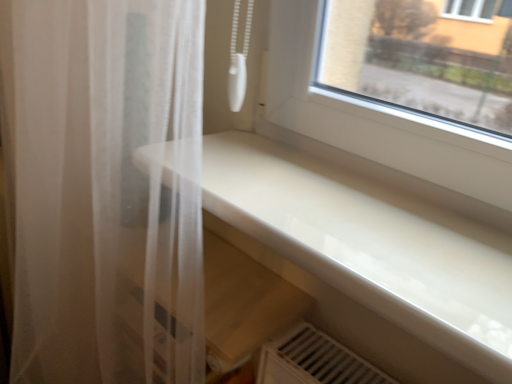
Question: Does point (422, 294) appear closer or farther from the camera than point (146, 288)?

Choices:
 (A) farther
 (B) closer

Answer: (B)

Question: Is white glossy counter top at center inside the boundaries of translucent white curtain at left, or outside?

Choices:
 (A) outside
 (B) inside

Answer: (A)

Question: Looking at their shapes, would you say white glossy counter top at center is wider or thinner than translucent white curtain at left?

Choices:
 (A) wide
 (B) thin

Answer: (A)

Question: From a real-world perspective, relative to white glossy counter top at center, is translucent white curtain at left vertically above or below?

Choices:
 (A) above
 (B) below

Answer: (B)

Question: Considering the positions of translucent white curtain at left and white glossy counter top at center in the image, is translucent white curtain at left wider or thinner than white glossy counter top at center?

Choices:
 (A) wide
 (B) thin

Answer: (B)

Question: Which is correct: translucent white curtain at left is inside white glossy counter top at center, or outside of it?

Choices:
 (A) outside
 (B) inside

Answer: (A)

Question: From their relative heights in the image, would you say translucent white curtain at left is taller or shorter than white glossy counter top at center?

Choices:
 (A) short
 (B) tall

Answer: (B)